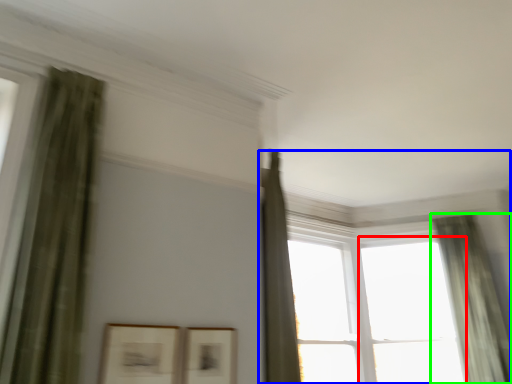
Question: Considering the real-world distances, which object is farthest from window (highlighted by a red box)? window (highlighted by a blue box) or curtain (highlighted by a green box)?

Choices:
 (A) window
 (B) curtain

Answer: (A)